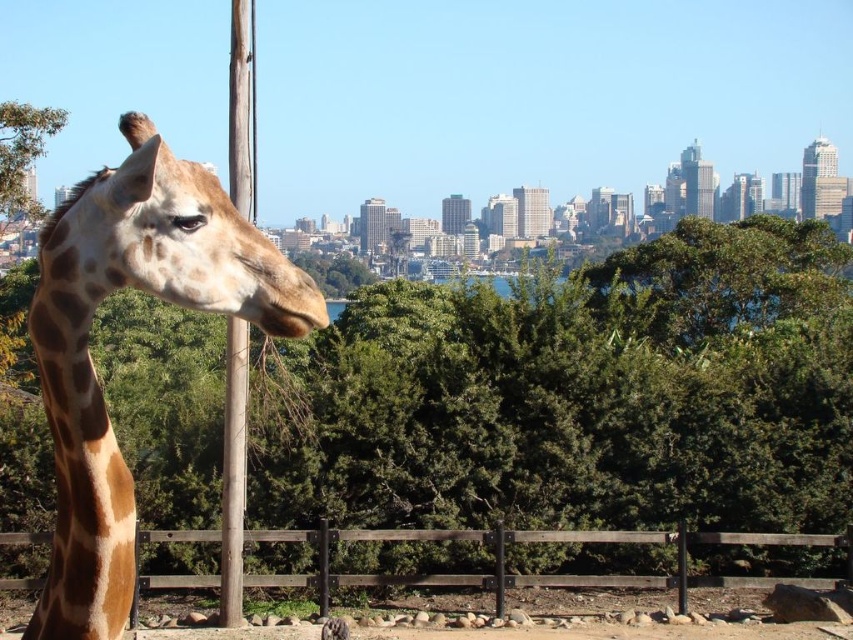
From the picture: Between spotted fur giraffe at left and brown wood pole at left, which one is positioned lower?

spotted fur giraffe at left

Can you confirm if spotted fur giraffe at left is positioned below brown wood pole at left?

Correct, spotted fur giraffe at left is located below brown wood pole at left.

Does point (54, 579) come farther from viewer compared to point (222, 486)?

No, (54, 579) is closer to viewer.

Identify the location of spotted fur giraffe at left. (91, 358).

The image size is (853, 640). What do you see at coordinates (546, 573) in the screenshot?
I see `brown wooden fence at lower center` at bounding box center [546, 573].

Who is more forward, (316,580) or (235,584)?

Point (235,584) is in front.

Does point (318, 588) lie behind point (234, 374)?

Yes, point (318, 588) is behind point (234, 374).

Locate an element on the screen. The image size is (853, 640). brown wooden fence at lower center is located at coordinates (546, 573).

Is spotted fur giraffe at left further to the viewer compared to brown wooden fence at lower center?

No.

Consider the image. Can you confirm if spotted fur giraffe at left is positioned to the left of brown wooden fence at lower center?

Yes, spotted fur giraffe at left is to the left of brown wooden fence at lower center.

Is point (77, 208) more distant than point (494, 547)?

No.

You are a GUI agent. You are given a task and a screenshot of the screen. Output one action in this format:
    pyautogui.click(x=<x>, y=<y>)
    Task: Click on the spotted fur giraffe at left
    This screenshot has width=853, height=640.
    Given the screenshot: What is the action you would take?
    pyautogui.click(x=91, y=358)